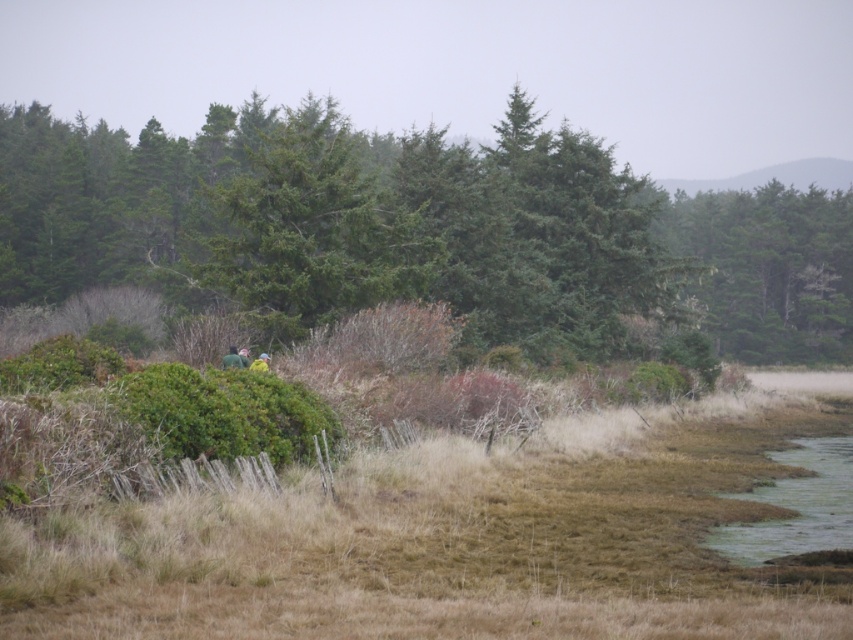
You are standing at the edge of the marshy area and see the green textured tree at center and the green matte jacket at center. Which object is closer to you?

The green matte jacket at center is closer to you because it is only 70.96 meters away from the green textured tree at center, so the jacket is nearer than the tree.

You are an ecologist studying the vegetation layers in this landscape. You observe the green textured tree at center and the green matte tree at right. Which tree is closer to you based on their spatial arrangement?

The green textured tree at center is closer to you because it is positioned in front of the green matte tree at right.